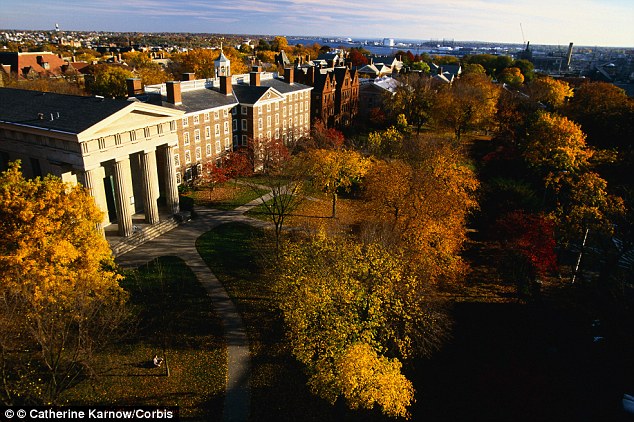
I want to click on window, so click(x=184, y=135), click(x=198, y=153), click(x=186, y=153).